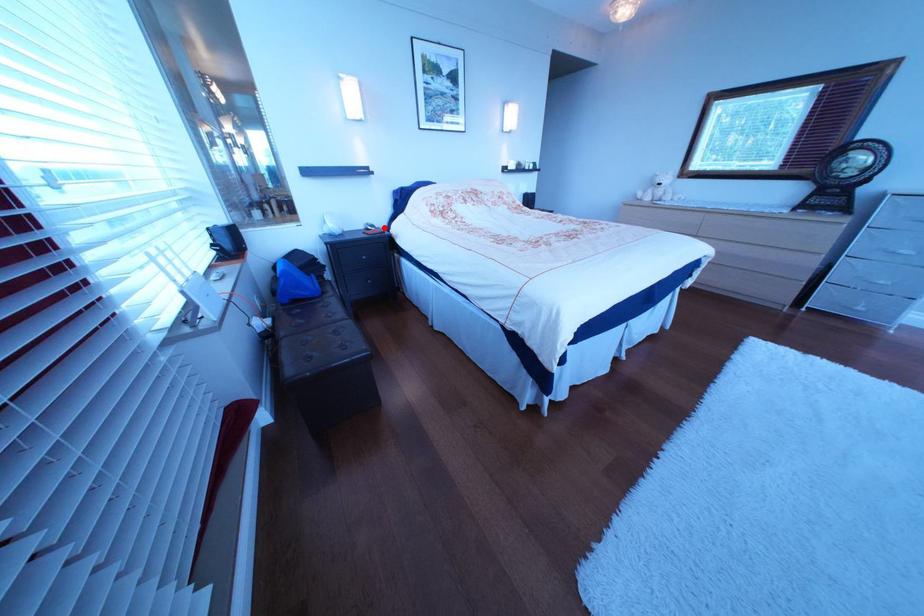
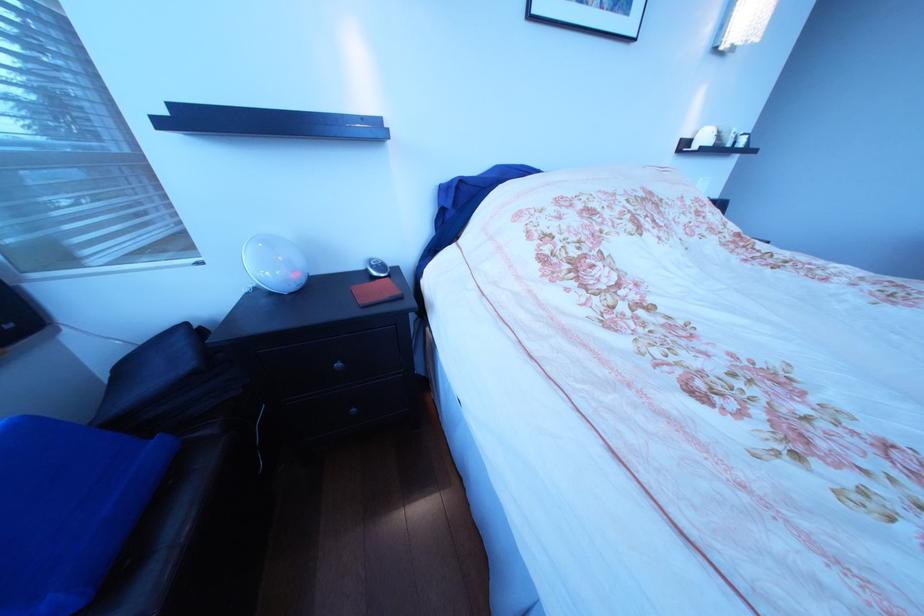
Locate, in the second image, the point that corresponds to the highlighted location in the first image.

(387, 268)